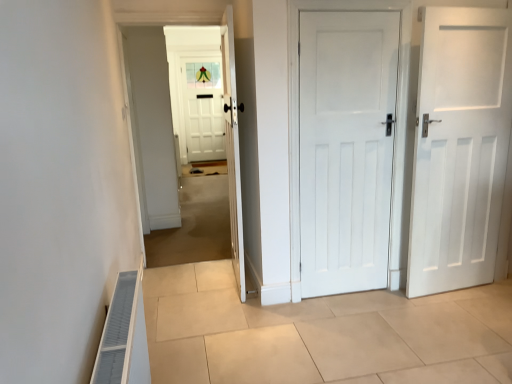
Where is `free space in front of white matte door at right, arranged as the first door when viewed from the right`? free space in front of white matte door at right, arranged as the first door when viewed from the right is located at coordinates (473, 320).